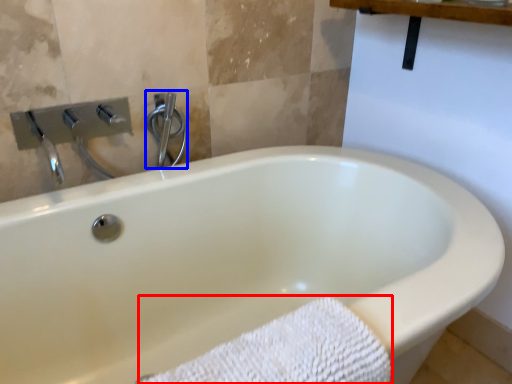
Question: Which of the following is the farthest to the observer, bath towel (highlighted by a red box) or shower (highlighted by a blue box)?

Choices:
 (A) bath towel
 (B) shower

Answer: (B)